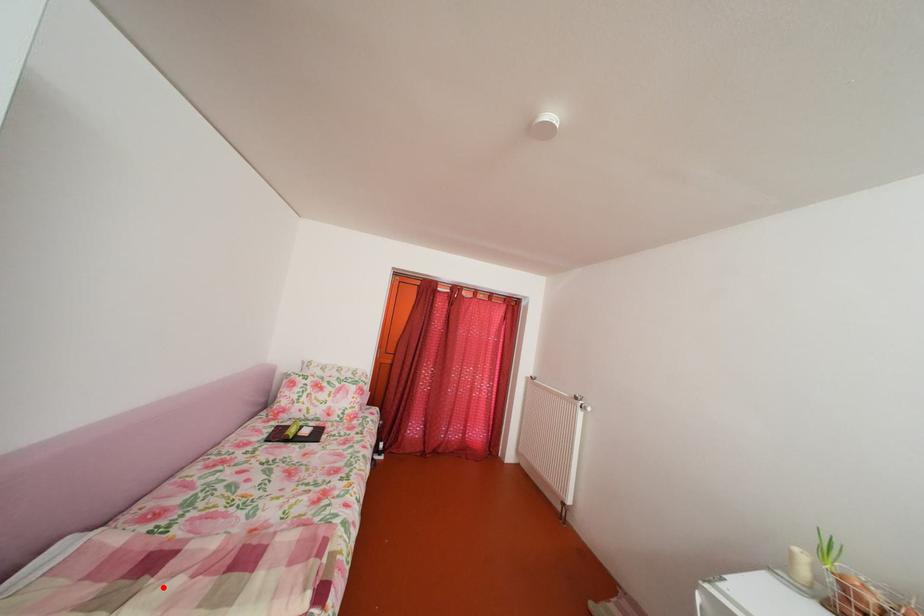
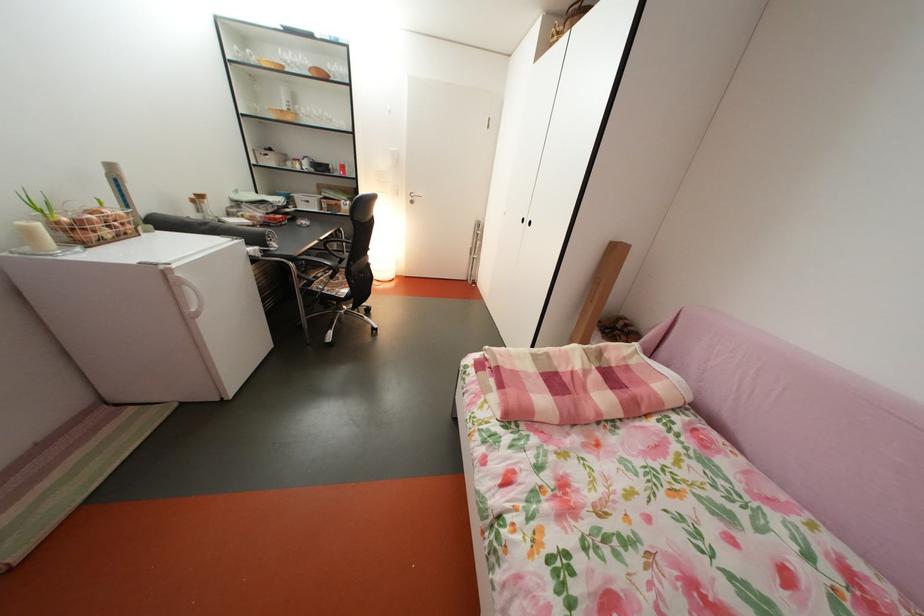
Question: I am providing you with two images of the same scene from different viewpoints. A red point is shown in image1. For the corresponding object point in image2, is it positioned nearer or farther from the camera?

Choices:
 (A) Nearer
 (B) Farther

Answer: (B)